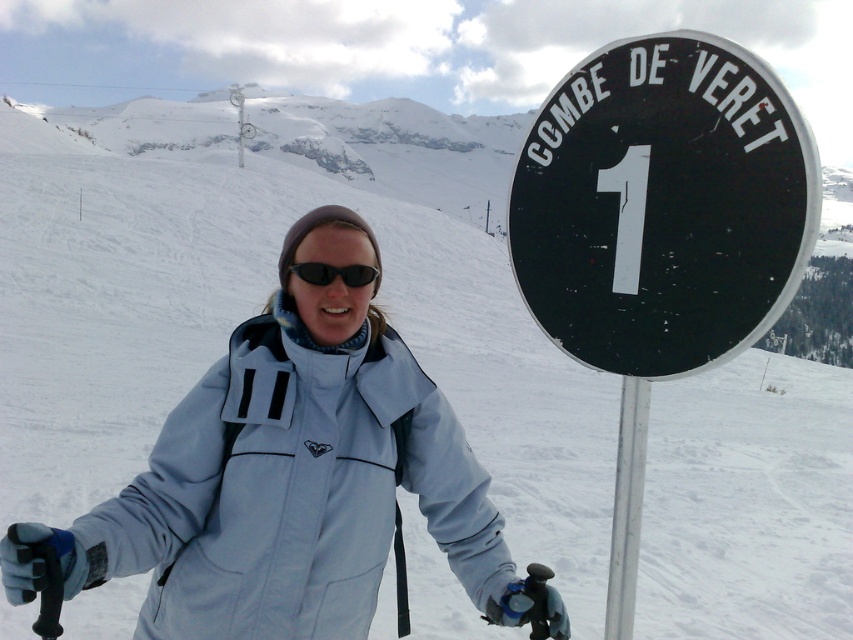
Based on the photo, you are a photographer trying to capture both the black plastic sign at upper right and the black matte sunglasses at center in a single frame. Since you want to emphasize the sign, which object should you position closer to the camera to maintain its prominence?

To emphasize the black plastic sign at upper right, position it closer to the camera since it is larger than the black matte sunglasses at center, making it naturally more prominent even at a distance.

You are a photographer trying to capture both the black plastic sign at upper right and the black matte sunglasses at center in a single frame. Based on their sizes, will the sign likely occupy more space in the photo than the sunglasses?

The black plastic sign at upper right might be wider than black matte sunglasses at center, so it is possible that the sign will occupy more space in the photo than the sunglasses.

You are a photographer taking a picture of the two points marked in the image. Which point, point 1 at coordinates (758, 208) or point 2 at coordinates (314, 266), is closer to your camera lens?

Point 1 at coordinates (758, 208) is closer to the camera lens than point 2 at coordinates (314, 266).